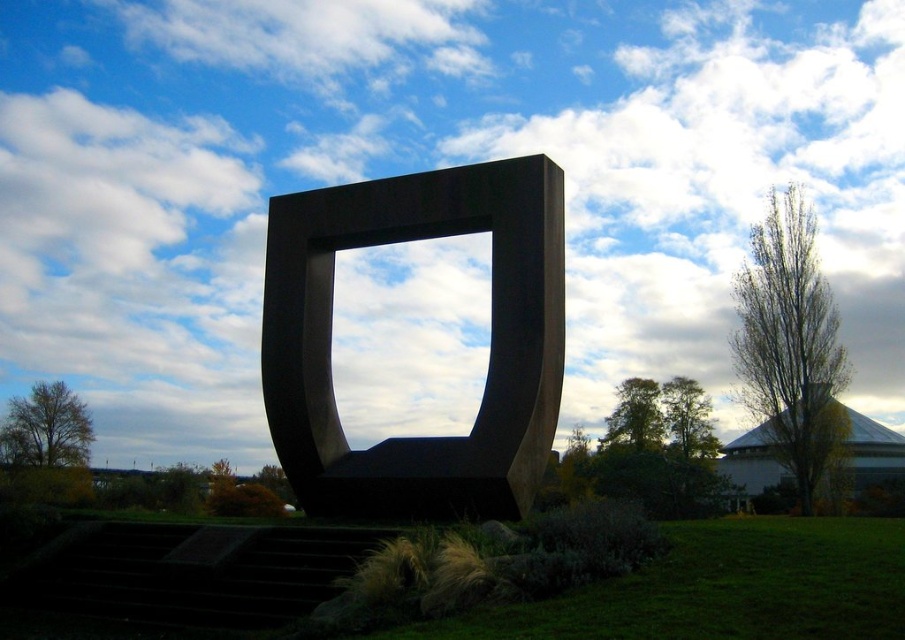
You are standing in front of the sculpture and want to see the green grass at lower center. Which direction should you move to ensure it becomes visible in front of the black polished stone sculpture at center?

The green grass at lower center is currently behind the black polished stone sculpture at center. To see it in front, you should move to the side of the sculpture so that the sculpture is between you and the grass, making the grass visible in front of it.

You are standing on the grassy area and want to take a photo of the black polished stone sculpture at center from its base. Since you are on the green grass at lower center, will you have to look up or down to frame the sculpture properly?

The black polished stone sculpture at center is above the green grass at lower center, so you will have to look up to frame it properly.

You are an artist planning to paint the scene. You need to decide which area to focus on first based on their widths. Which object is narrower between the black polished stone sculpture at center and the green grass at lower center?

The black polished stone sculpture at center has a lesser width compared to the green grass at lower center, so it is narrower.